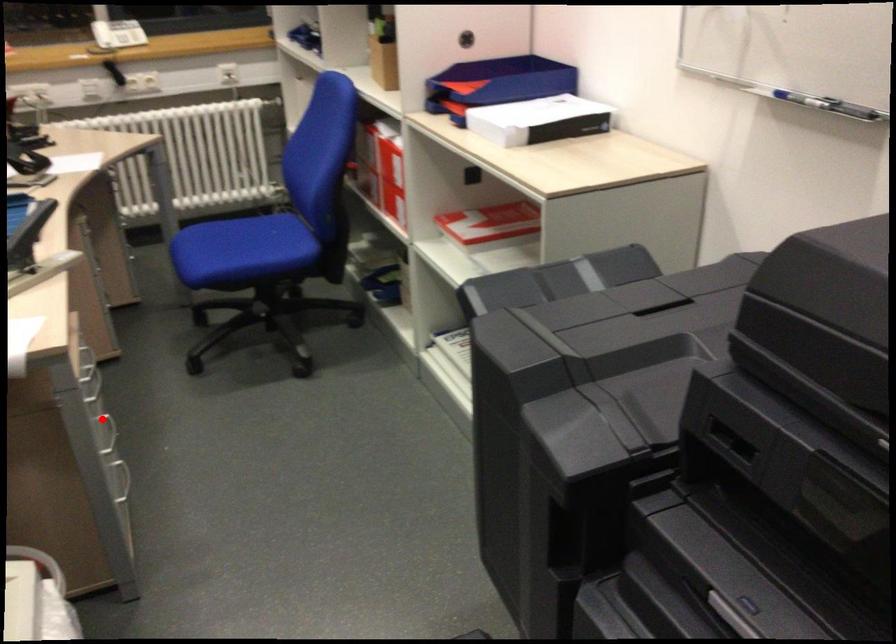
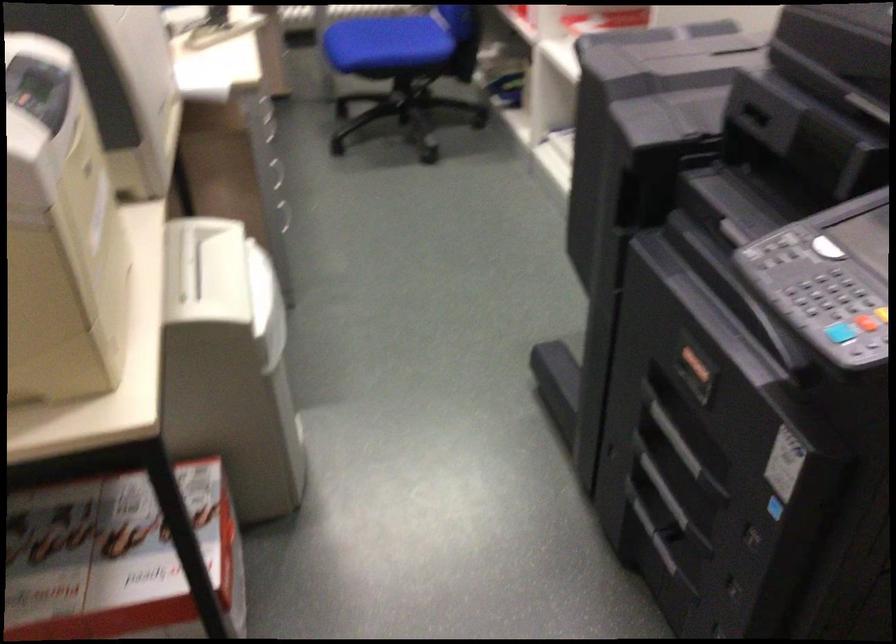
Question: I am providing you with two images of the same scene from different viewpoints. A red point is marked on the first image. Is the red point's position out of view in image 2?

Choices:
 (A) Yes
 (B) No

Answer: (A)